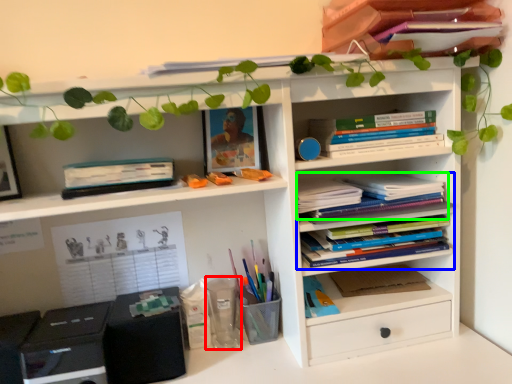
Question: Based on their relative distances, which object is farther from stationery (highlighted by a red box)? Choose from book (highlighted by a blue box) and book (highlighted by a green box).

Choices:
 (A) book
 (B) book

Answer: (B)